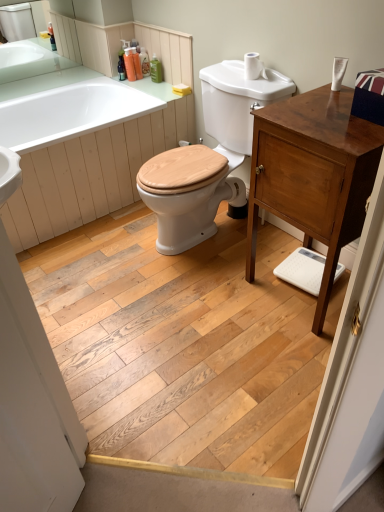
Locate an element on the screen. The height and width of the screenshot is (512, 384). vacant space behind natural wood screen door at lower left is located at coordinates (77, 273).